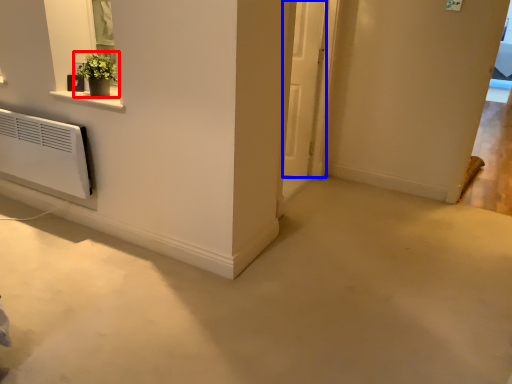
Question: Which object is further to the camera taking this photo, houseplant (highlighted by a red box) or door (highlighted by a blue box)?

Choices:
 (A) houseplant
 (B) door

Answer: (B)